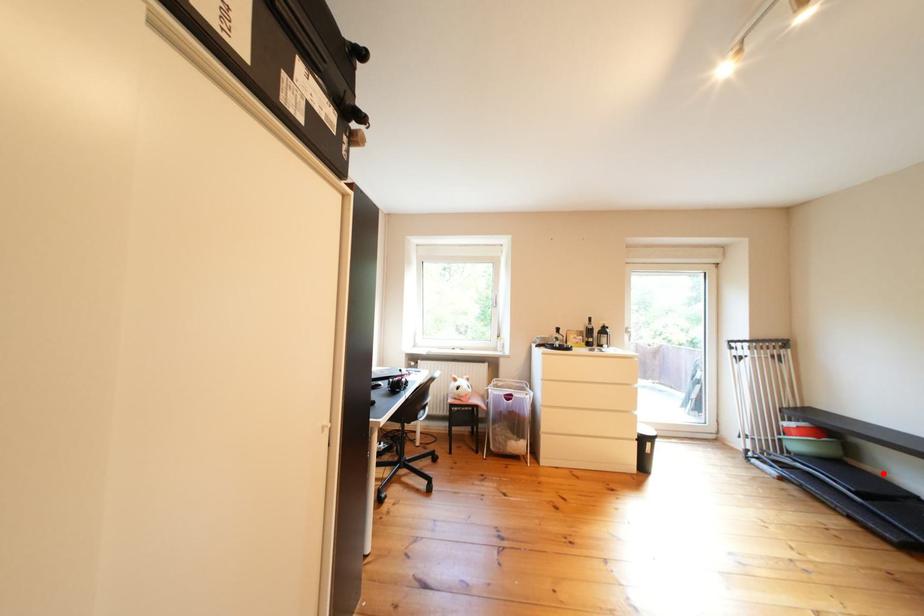
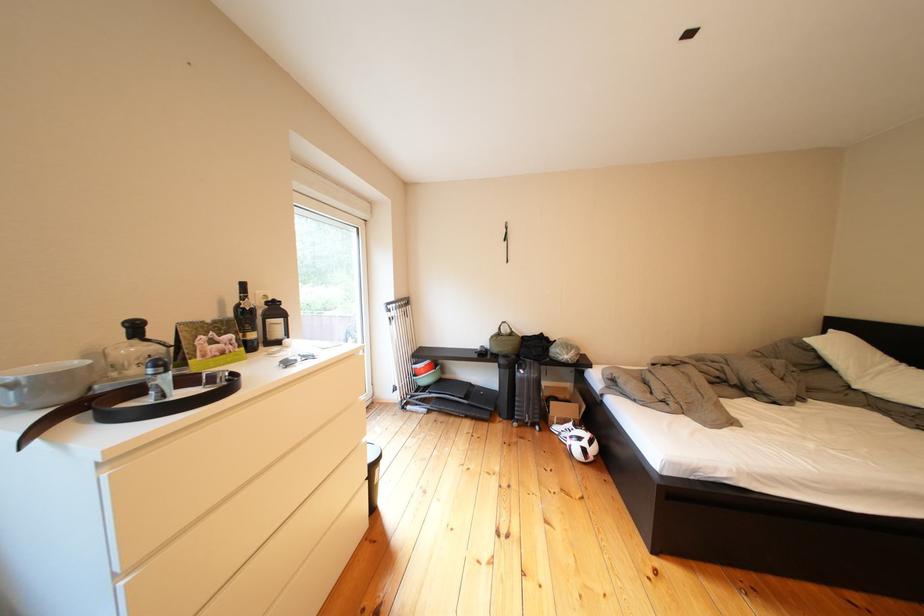
The point at the highlighted location is marked in the first image. Where is the corresponding point in the second image?

(462, 381)